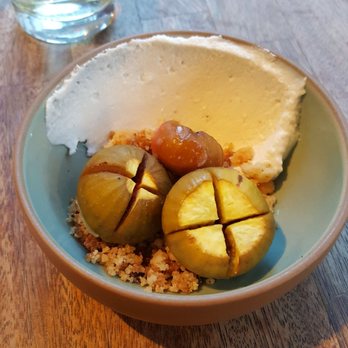
Where is `cracks between boards in table`? The height and width of the screenshot is (348, 348). cracks between boards in table is located at coordinates (208, 8), (141, 14), (285, 20), (270, 38).